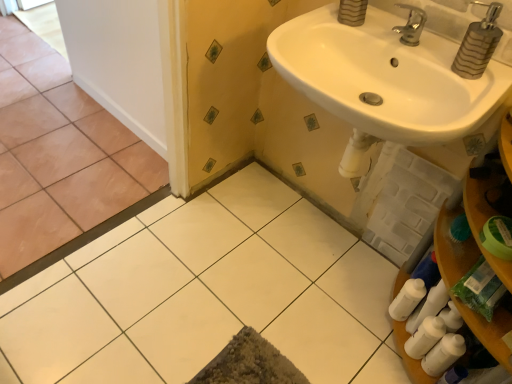
Question: Does white glossy sink at upper right have a greater height compared to brown matte tile at left, arranged as the second ceramic tile when viewed from the right?

Choices:
 (A) yes
 (B) no

Answer: (A)

Question: Is white glossy sink at upper right next to brown matte tile at left, which appears as the 1th ceramic tile when viewed from the left, and touching it?

Choices:
 (A) yes
 (B) no

Answer: (B)

Question: Is brown matte tile at left, which appears as the 1th ceramic tile when viewed from the left, at the back of white glossy sink at upper right?

Choices:
 (A) yes
 (B) no

Answer: (B)

Question: Does white glossy sink at upper right lie behind brown matte tile at left, arranged as the second ceramic tile when viewed from the right?

Choices:
 (A) no
 (B) yes

Answer: (A)

Question: From a real-world perspective, is white glossy sink at upper right positioned under brown matte tile at left, arranged as the second ceramic tile when viewed from the right, based on gravity?

Choices:
 (A) yes
 (B) no

Answer: (B)

Question: Can you confirm if white glossy sink at upper right is shorter than brown matte tile at left, arranged as the second ceramic tile when viewed from the right?

Choices:
 (A) no
 (B) yes

Answer: (A)

Question: Does metallic striped soap dispenser at upper right have a greater width compared to silver metallic faucet at upper right?

Choices:
 (A) no
 (B) yes

Answer: (A)

Question: From the image's perspective, is metallic striped soap dispenser at upper right located above silver metallic faucet at upper right?

Choices:
 (A) no
 (B) yes

Answer: (A)

Question: Is metallic striped soap dispenser at upper right closer to the viewer compared to silver metallic faucet at upper right?

Choices:
 (A) yes
 (B) no

Answer: (A)

Question: From a real-world perspective, is metallic striped soap dispenser at upper right positioned over silver metallic faucet at upper right based on gravity?

Choices:
 (A) no
 (B) yes

Answer: (B)

Question: Is metallic striped soap dispenser at upper right oriented towards silver metallic faucet at upper right?

Choices:
 (A) yes
 (B) no

Answer: (B)

Question: Is metallic striped soap dispenser at upper right positioned behind silver metallic faucet at upper right?

Choices:
 (A) yes
 (B) no

Answer: (B)

Question: Would you say silver metallic faucet at upper right is outside metallic striped soap dispenser at upper right?

Choices:
 (A) no
 (B) yes

Answer: (B)